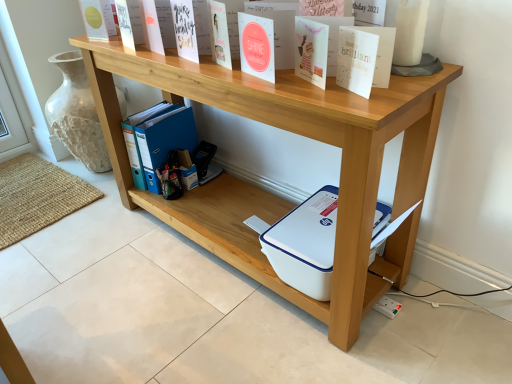
The width and height of the screenshot is (512, 384). Find the location of `vacant region in front of white paper at upper right, the 3th paperback book in the back-to-front sequence`. vacant region in front of white paper at upper right, the 3th paperback book in the back-to-front sequence is located at coordinates (364, 106).